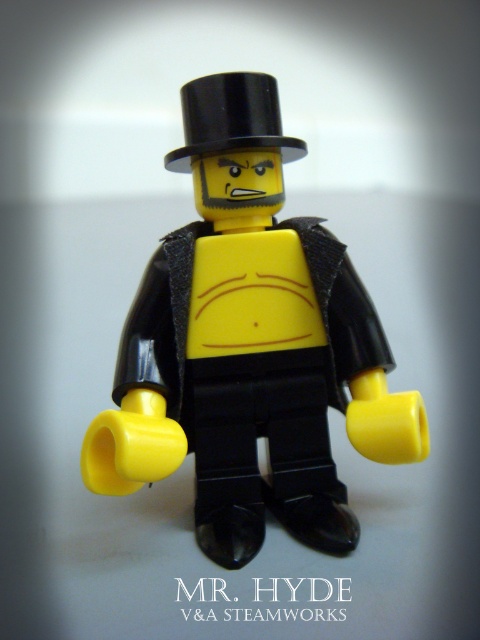
In the scene shown: You are a LEGO designer trying to fit the matte black minifigure at center and the black glossy top hat at upper center into a display case. The case has a width limit of 10 cm. If the combined width of both items is 12 cm, will they fit together?

The matte black minifigure at center is wider than the black glossy top hat at upper center. However, since their combined width is 12 cm and the case only allows 10 cm, they cannot fit together in the display case.

You are a LEGO collector who wants to display the matte black minifigure at center on a shelf that is 36 inches long. Can you fit the minifigure on the shelf without it hanging over the edge?

The matte black minifigure at center is 36.30 inches apart, so it cannot fit on a 36 inch shelf without hanging over the edge.

You are a LEGO designer trying to position two stickers on a new minifigure. The stickers must be placed at the coordinates point (271, 317) and point (228, 145). From the front view of the minifigure, which sticker will appear closer to you?

Point (228, 145) will appear closer to you because it is in front of point (271, 317) according to their spatial arrangement.